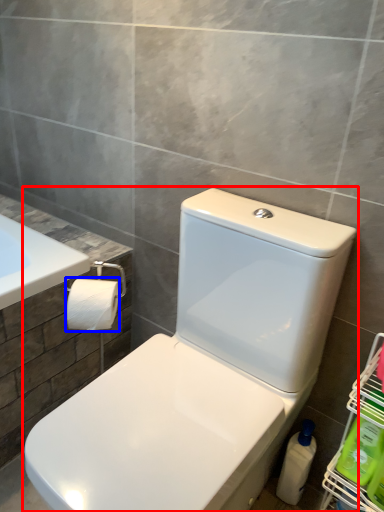
Question: Among these objects, which one is farthest to the camera, toilet (highlighted by a red box) or toilet paper (highlighted by a blue box)?

Choices:
 (A) toilet
 (B) toilet paper

Answer: (B)